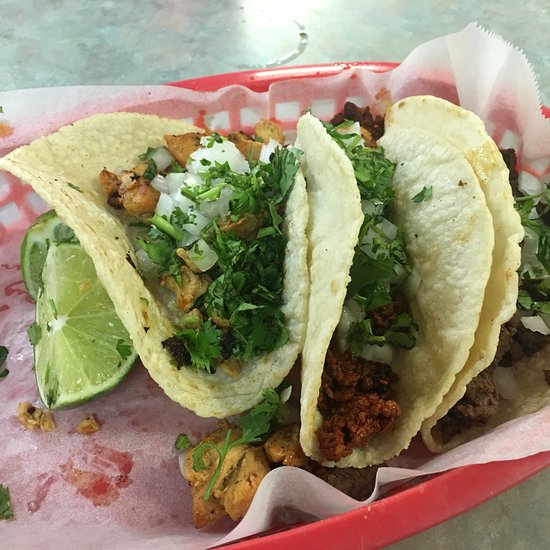
Find the location of a particular element. Image resolution: width=550 pixels, height=550 pixels. moisture ring from drink is located at coordinates (301, 46).